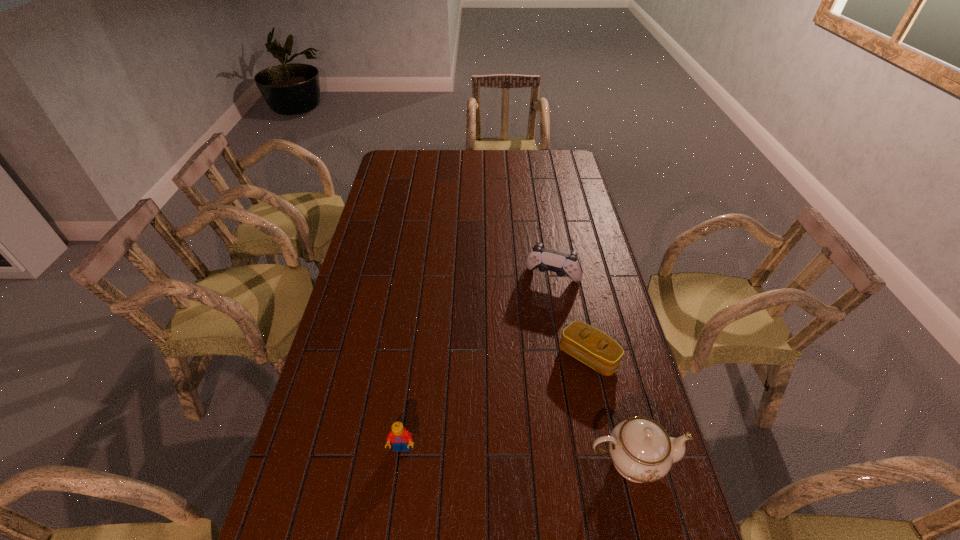
Locate an element on the screen. The image size is (960, 540). vacant spot on the desktop that is between the Lego and the chinaware and is positioned on the front-facing side of the farthest object is located at coordinates (486, 453).

At what (x,y) coordinates should I click in order to perform the action: click on vacant space on the desktop that is between the second shortest object and the chinaware and is positioned on the zipper side of the shortest object. Please return your answer as a coordinate pair (x, y). The width and height of the screenshot is (960, 540). Looking at the image, I should click on (492, 454).